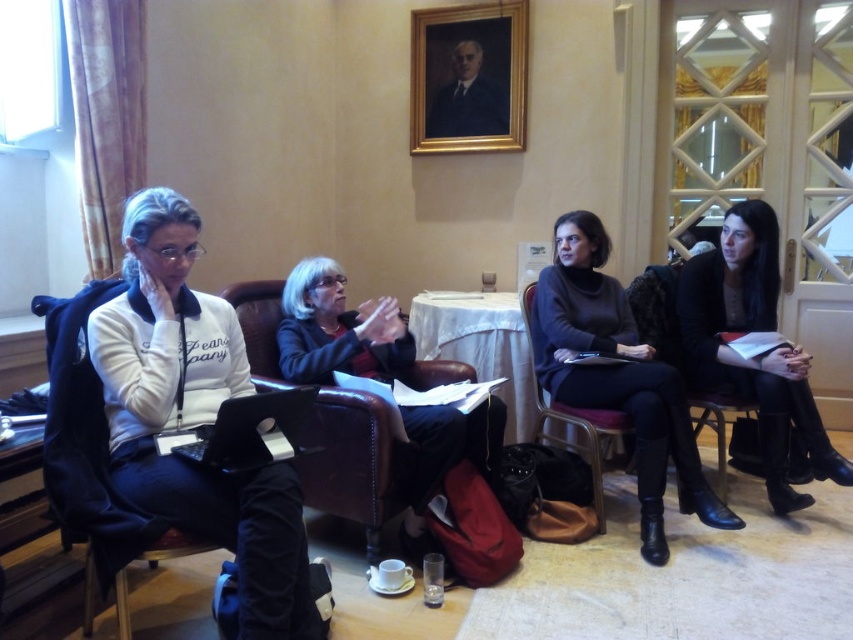
Based on the scene description, can you determine which object is taller between the white matte jacket at left and the metallic brown chair at center?

The white matte jacket at left is much taller than the metallic brown chair at center.